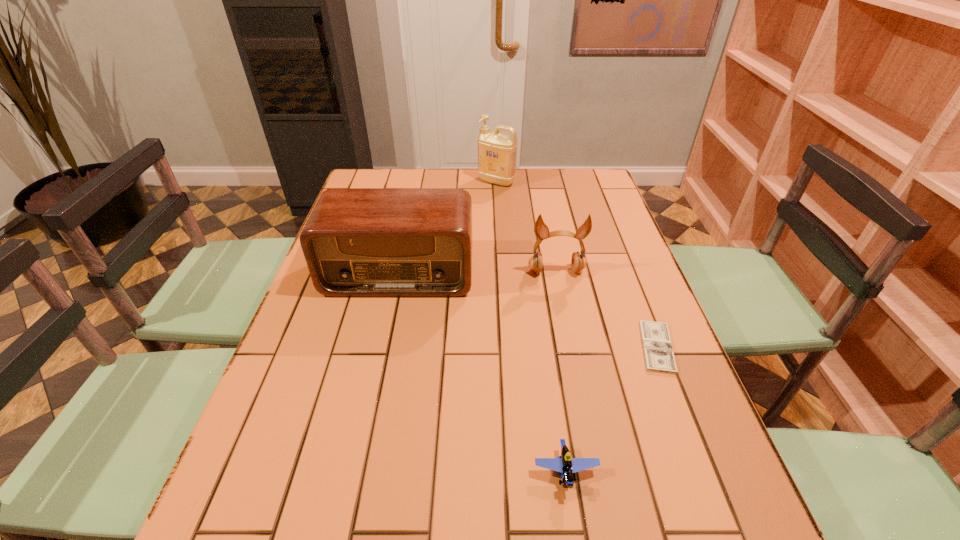
Where is `the farthest object`? the farthest object is located at coordinates (497, 152).

The image size is (960, 540). I want to click on radio receiver, so click(x=358, y=242).

The width and height of the screenshot is (960, 540). I want to click on earphone, so click(x=578, y=262).

Find the location of `the nearest object`. the nearest object is located at coordinates (565, 465).

What are the coordinates of `Lego` in the screenshot? It's located at (565, 465).

I want to click on the second nearest object, so click(658, 353).

Identify the location of the rightmost object. (658, 353).

Locate an element on the screen. This screenshot has width=960, height=540. vacant area situated 0.280m on the right of the detergent is located at coordinates (592, 181).

Where is `blank area located on the front panel of the radio receiver`? blank area located on the front panel of the radio receiver is located at coordinates (372, 405).

Find the location of a particular element. vacant region located 0.320m on the front-facing side of the earphone is located at coordinates (577, 375).